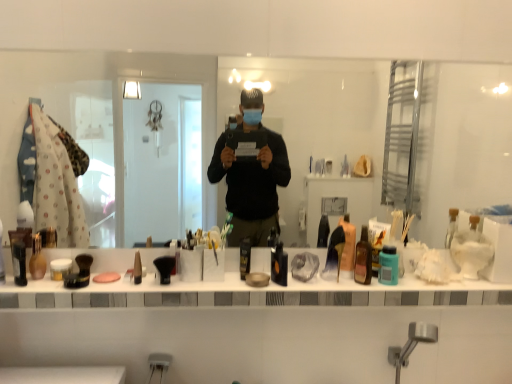
Question: Is transparent glass mirror at center looking in the opposite direction of translucent plastic bottle at center, which is counted as the 7th toiletry, starting from the left?

Choices:
 (A) yes
 (B) no

Answer: (B)

Question: Does transparent glass mirror at center lie in front of translucent plastic bottle at center, which is counted as the 7th toiletry, starting from the left?

Choices:
 (A) no
 (B) yes

Answer: (B)

Question: Does transparent glass mirror at center appear on the left side of translucent plastic bottle at center, which is counted as the 7th toiletry, starting from the left?

Choices:
 (A) yes
 (B) no

Answer: (A)

Question: Considering the relative sizes of transparent glass mirror at center and translucent plastic bottle at center, which is counted as the 7th toiletry, starting from the left, in the image provided, is transparent glass mirror at center taller than translucent plastic bottle at center, which is counted as the 7th toiletry, starting from the left,?

Choices:
 (A) yes
 (B) no

Answer: (A)

Question: Is transparent glass mirror at center bigger than translucent plastic bottle at center, which is counted as the 7th toiletry, starting from the left?

Choices:
 (A) no
 (B) yes

Answer: (B)

Question: Can translucent plastic bottle at center, acting as the fourth toiletry starting from the right, be found inside transparent glass mirror at center?

Choices:
 (A) no
 (B) yes

Answer: (A)

Question: Does matte brown vase at left, the 9th toiletry positioned from the right, appear on the right side of pink matte soap at center?

Choices:
 (A) no
 (B) yes

Answer: (A)

Question: Does matte brown vase at left, the 2th toiletry viewed from the left, appear on the left side of pink matte soap at center?

Choices:
 (A) no
 (B) yes

Answer: (B)

Question: From the image's perspective, would you say matte brown vase at left, the 2th toiletry viewed from the left, is positioned over pink matte soap at center?

Choices:
 (A) no
 (B) yes

Answer: (B)

Question: From a real-world perspective, does matte brown vase at left, the 9th toiletry positioned from the right, sit lower than pink matte soap at center?

Choices:
 (A) yes
 (B) no

Answer: (B)

Question: Does matte brown vase at left, the 9th toiletry positioned from the right, have a greater width compared to pink matte soap at center?

Choices:
 (A) yes
 (B) no

Answer: (B)

Question: Can pink matte soap at center be found inside matte brown vase at left, the 9th toiletry positioned from the right?

Choices:
 (A) yes
 (B) no

Answer: (B)

Question: Can you confirm if white matte jar at center, the 8th toiletry viewed from the right, is shorter than matte black brush at center, positioned as the seventh toiletry in right-to-left order?

Choices:
 (A) no
 (B) yes

Answer: (B)